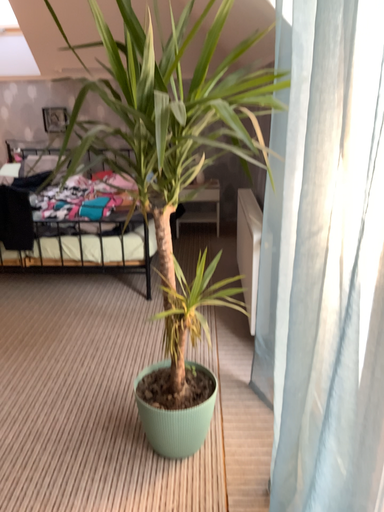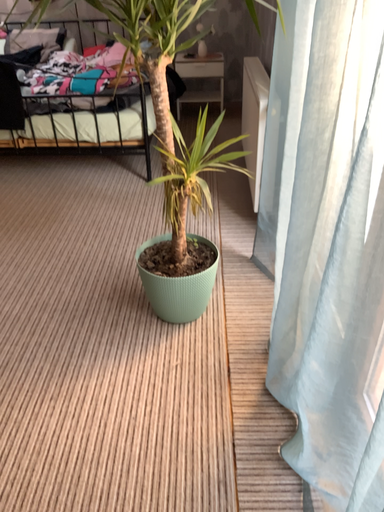
Question: Which way did the camera rotate in the video?

Choices:
 (A) rotated downward
 (B) rotated upward

Answer: (A)